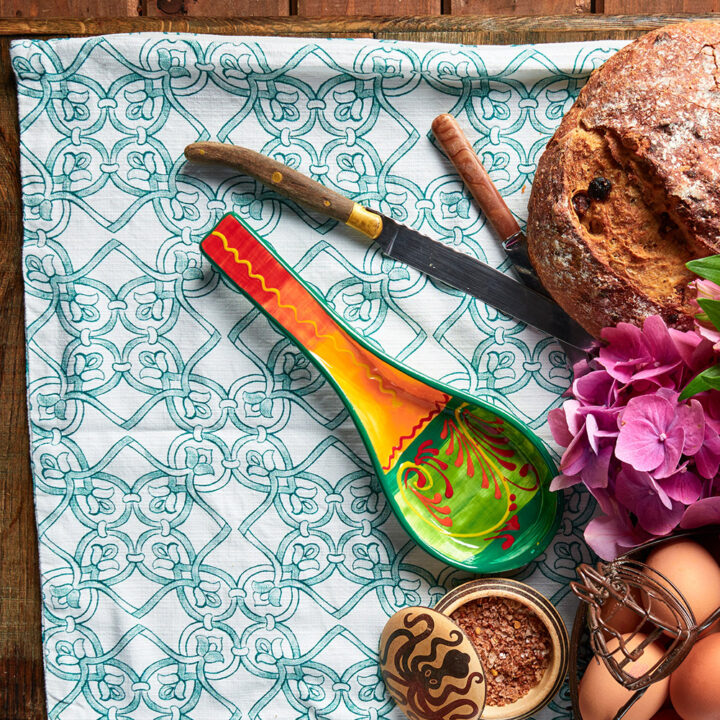
In order to click on table cloth with green vine patterns on it in this screenshot , I will do `click(222, 415)`.